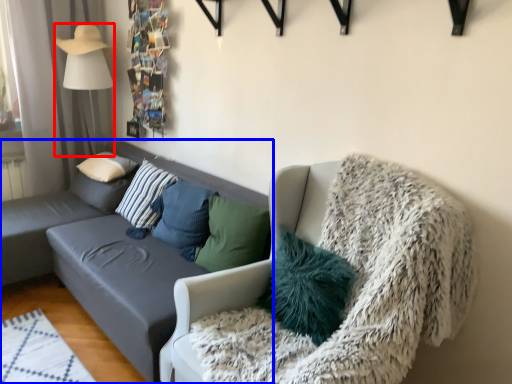
Question: Which object is closer to the camera taking this photo, lamp (highlighted by a red box) or studio couch (highlighted by a blue box)?

Choices:
 (A) lamp
 (B) studio couch

Answer: (B)